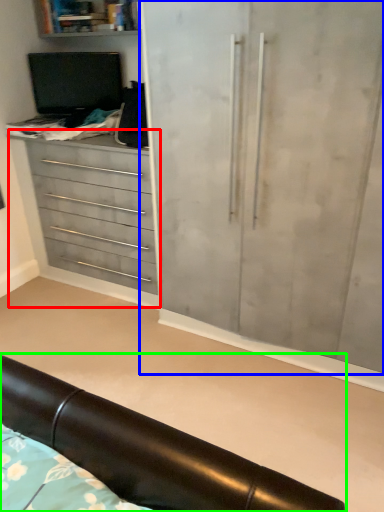
Question: Based on their relative distances, which object is farther from chest of drawers (highlighted by a red box)? Choose from cupboard (highlighted by a blue box) and furniture (highlighted by a green box).

Choices:
 (A) cupboard
 (B) furniture

Answer: (B)